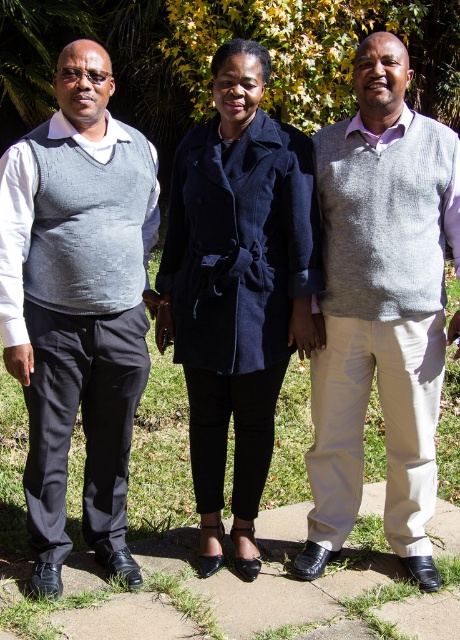
Question: Among these points, which one is nearest to the camera?

Choices:
 (A) (38, 225)
 (B) (360, 108)
 (C) (228, 157)

Answer: (A)

Question: Is grey knitted vest at center bigger than velvet black coat at center?

Choices:
 (A) no
 (B) yes

Answer: (A)

Question: Which point is closer to the camera?

Choices:
 (A) (424, 150)
 (B) (197, 250)
 (C) (82, 240)

Answer: (C)

Question: Considering the real-world distances, which object is closest to the velvet black coat at center?

Choices:
 (A) matte gray sweater vest at left
 (B) grey knitted vest at center

Answer: (B)

Question: Does grey knitted vest at center have a larger size compared to velvet black coat at center?

Choices:
 (A) yes
 (B) no

Answer: (B)

Question: Is grey knitted vest at center to the left of velvet black coat at center from the viewer's perspective?

Choices:
 (A) yes
 (B) no

Answer: (B)